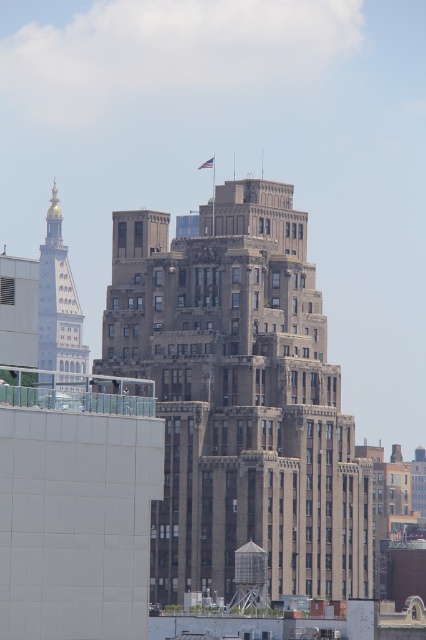
Is brown stone building at center taller than gold-bronze tower at left?

Yes.

Between brown stone building at center and gold-bronze tower at left, which one is positioned higher?

Positioned higher is gold-bronze tower at left.

Is point (362, 522) positioned before point (55, 232)?

Yes, point (362, 522) is closer to viewer.

Locate an element on the screen. This screenshot has width=426, height=640. brown stone building at center is located at coordinates (239, 397).